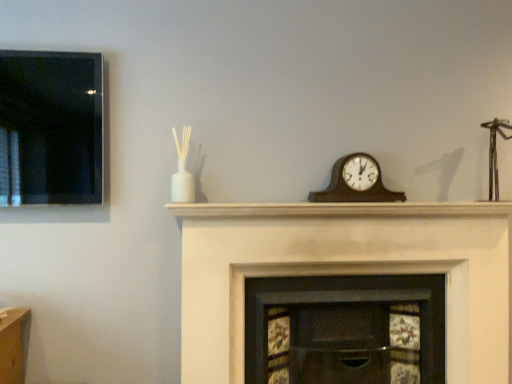
Question: From the image's perspective, is wooden clock at center located above or below white painted wood fireplace at center, the 2th fireplace from the left?

Choices:
 (A) above
 (B) below

Answer: (A)

Question: From a real-world perspective, is wooden clock at center physically located above or below white painted wood fireplace at center, positioned as the 1th fireplace in right-to-left order?

Choices:
 (A) above
 (B) below

Answer: (A)

Question: Estimate the real-world distances between objects in this image. Which object is closer to the wooden fireplace at center, positioned as the first fireplace in left-to-right order?

Choices:
 (A) white matte mantle at center
 (B) white painted wood fireplace at center, positioned as the 1th fireplace in right-to-left order
 (C) wooden clock at center

Answer: (B)

Question: Which of these objects is positioned closest to the white matte mantle at center?

Choices:
 (A) white painted wood fireplace at center, positioned as the 1th fireplace in right-to-left order
 (B) wooden fireplace at center, which appears as the second fireplace when viewed from the right
 (C) wooden clock at center

Answer: (C)